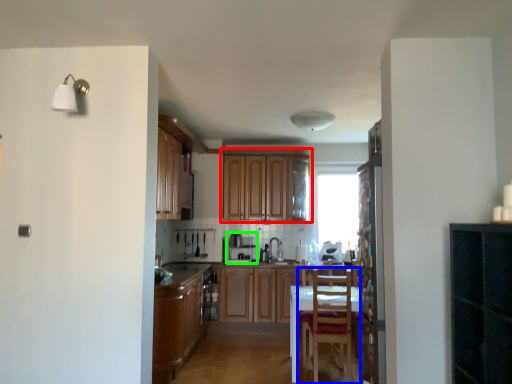
Question: Which is farther away from cabinetry (highlighted by a red box)? chair (highlighted by a blue box) or appliance (highlighted by a green box)?

Choices:
 (A) chair
 (B) appliance

Answer: (A)